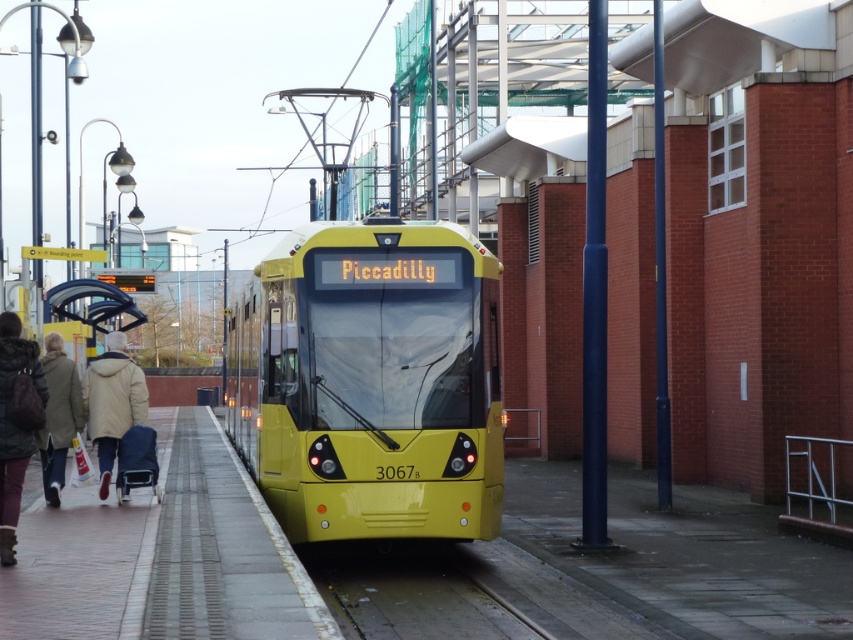
You are standing on the tram station platform and want to determine the relative positions of two points marked on the platform. Which of the two points, point (492, 612) or point (137, 401), is closer to you?

Point (492, 612) is closer to the viewer than point (137, 401).

You are a passenger waiting on the platform at the tram station. You see the yellow matte train at center and the beige woolen coat at left. Which object is closer to the ground?

The yellow matte train at center is closer to the ground because it is below the beige woolen coat at left.

You are a passenger waiting at the tram station. You see the yellow matte train at center and the beige woolen coat at left. Which object is positioned closer to the right side of the platform?

The yellow matte train at center is positioned closer to the right side of the platform than the beige woolen coat at left.